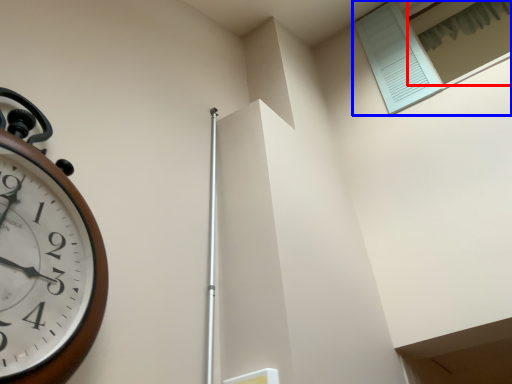
Question: Among these objects, which one is farthest to the camera, window (highlighted by a red box) or window (highlighted by a blue box)?

Choices:
 (A) window
 (B) window

Answer: (A)